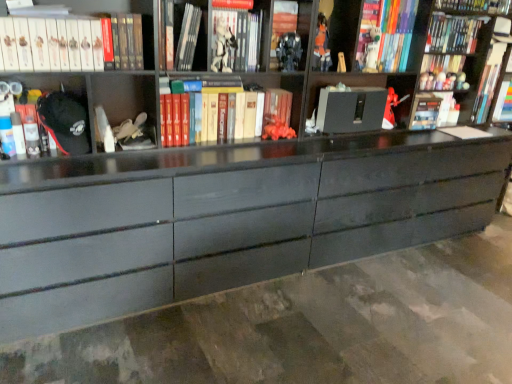
Question: Considering the relative sizes of matte black figurine at upper center, marked as the first toy in a front-to-back arrangement, and white matte book at upper left, marked as the tenth book in a right-to-left arrangement, in the image provided, is matte black figurine at upper center, marked as the first toy in a front-to-back arrangement, wider than white matte book at upper left, marked as the tenth book in a right-to-left arrangement,?

Choices:
 (A) no
 (B) yes

Answer: (A)

Question: Does matte black figurine at upper center, the 1th toy positioned from the left, appear on the left side of white matte book at upper left, marked as the tenth book in a right-to-left arrangement?

Choices:
 (A) yes
 (B) no

Answer: (B)

Question: Does matte black figurine at upper center, the 1th toy positioned from the left, have a greater height compared to white matte book at upper left, marked as the first book in a left-to-right arrangement?

Choices:
 (A) yes
 (B) no

Answer: (B)

Question: Does matte black figurine at upper center, marked as the first toy in a front-to-back arrangement, have a smaller size compared to white matte book at upper left, marked as the first book in a left-to-right arrangement?

Choices:
 (A) yes
 (B) no

Answer: (A)

Question: Is matte black figurine at upper center, marked as the first toy in a front-to-back arrangement, at the right side of white matte book at upper left, marked as the tenth book in a right-to-left arrangement?

Choices:
 (A) yes
 (B) no

Answer: (A)

Question: From the image's perspective, is matte black figurine at upper center, the 1th toy positioned from the left, under white matte book at upper left, marked as the tenth book in a right-to-left arrangement?

Choices:
 (A) yes
 (B) no

Answer: (B)

Question: Is black matte cabinet at center outside matte black figurine at upper center, the 1th toy positioned from the left?

Choices:
 (A) yes
 (B) no

Answer: (A)

Question: Would you say black matte cabinet at center contains matte black figurine at upper center, marked as the first toy in a front-to-back arrangement?

Choices:
 (A) yes
 (B) no

Answer: (B)

Question: From the image's perspective, is black matte cabinet at center below matte black figurine at upper center, the 1th toy positioned from the left?

Choices:
 (A) no
 (B) yes

Answer: (B)

Question: Is black matte cabinet at center to the right of matte black figurine at upper center, the fifth toy from the back, from the viewer's perspective?

Choices:
 (A) yes
 (B) no

Answer: (A)

Question: Is black matte cabinet at center oriented away from matte black figurine at upper center, which is the fifth toy from right to left?

Choices:
 (A) yes
 (B) no

Answer: (B)

Question: Does black matte cabinet at center have a lesser width compared to matte black figurine at upper center, the 1th toy positioned from the left?

Choices:
 (A) no
 (B) yes

Answer: (A)

Question: Does hardcover book at upper center, which ranks as the 6th book in left-to-right order, have a lesser width compared to hardcover book at upper left, arranged as the second book when viewed from the left?

Choices:
 (A) no
 (B) yes

Answer: (B)